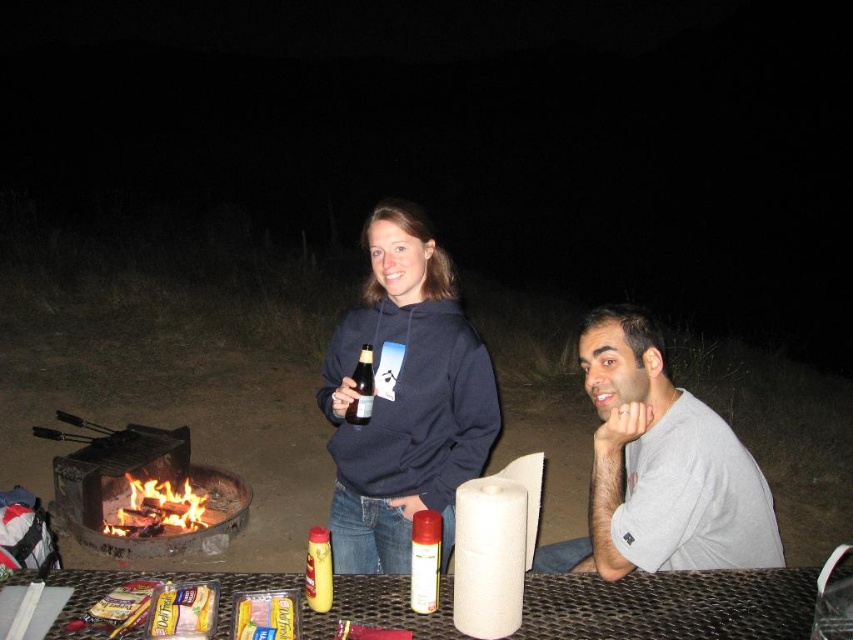
You are planning to pack these items into a backpack. The backpack has a compartment that can only fit items narrower than 10 cm. Which of the two items, the satin gold spray can at center or the brown glass bottle at center, can definitely fit into this compartment?

The satin gold spray can at center has a smaller width than the brown glass bottle at center, so it can definitely fit into the compartment if the bottle is wider than 10 cm. However, without knowing the exact width of the bottle, we can only confirm the spray can is narrower than the bottle, but not necessarily under 10 cm.

In the scene shown: You are planning to pack your camping gear and need to choose between the yellow plastic cheese at table center and the yellow plastic bottle at center. Which item takes up less space?

The yellow plastic cheese at table center is smaller than the yellow plastic bottle at center, so it takes up less space.